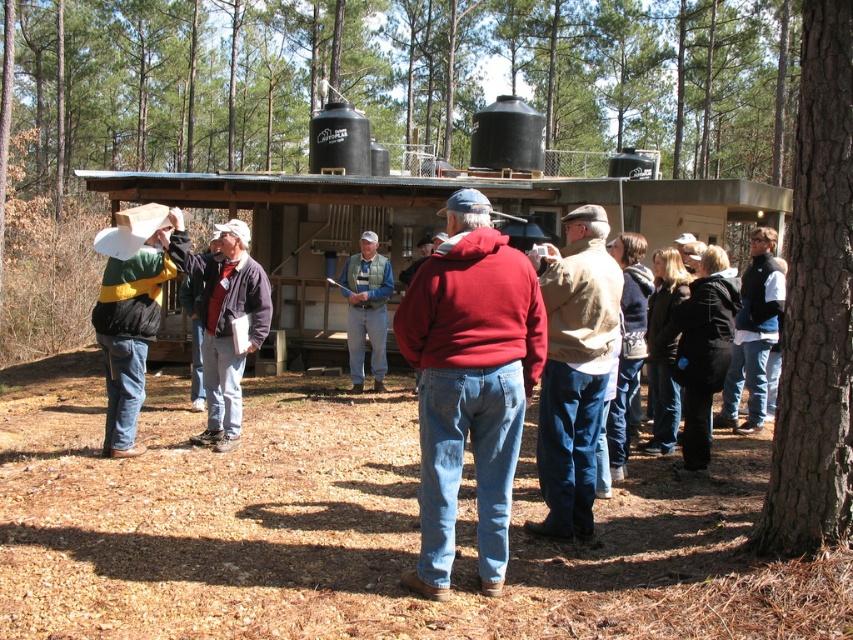
You are a hiker who just arrived at the wooded area and see the matte black jacket at center and the black fleece jacket at lower right. Which jacket is closer to you?

The matte black jacket at center is closer to you because the black fleece jacket at lower right is behind it.

You are standing in front of the structure with two large cylindrical tanks. There are two points marked on the tanks. Which point is closer to you, point at coordinate (521, 262) or point at coordinate (709, 381)?

Point at coordinate (521, 262) is closer to you than point at coordinate (709, 381).

You are a photographer trying to capture both the red matte hoodie at center and the black fleece jacket at lower right in a single shot. Which clothing item will appear larger in the photo?

The red matte hoodie at center appears larger in the photo because it is closer to the camera than the black fleece jacket at lower right.